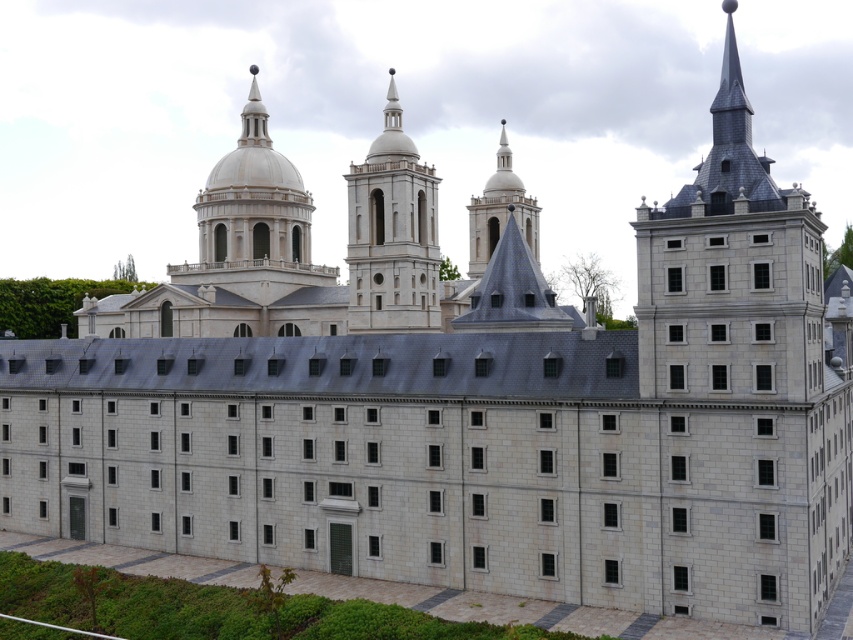
Question: Which point is farther to the camera?

Choices:
 (A) (403, 310)
 (B) (747, 600)

Answer: (A)

Question: Where is gray stone tower at upper center located in relation to smooth gray steeple at center in the image?

Choices:
 (A) above
 (B) below

Answer: (B)

Question: Among these objects, which one is nearest to the camera?

Choices:
 (A) gray stone tower at upper center
 (B) smooth gray steeple at center
 (C) white stone tower at center

Answer: (A)

Question: Can you confirm if gray stone tower at upper center is positioned to the left of white stone tower at center?

Choices:
 (A) yes
 (B) no

Answer: (B)

Question: Is gray stone tower at upper center to the left of white stone tower at center from the viewer's perspective?

Choices:
 (A) no
 (B) yes

Answer: (A)

Question: Which point is farther from the camera taking this photo?

Choices:
 (A) (718, 465)
 (B) (508, 148)
 (C) (370, 236)

Answer: (B)